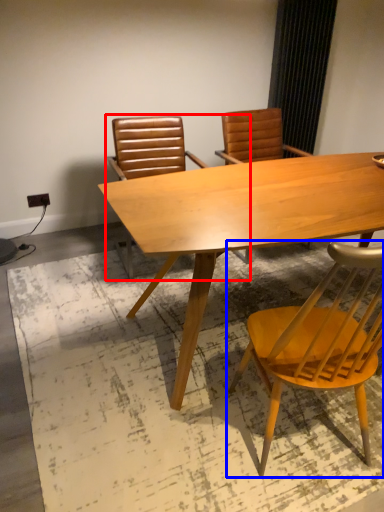
Question: Which object is further to the camera taking this photo, chair (highlighted by a red box) or chair (highlighted by a blue box)?

Choices:
 (A) chair
 (B) chair

Answer: (A)